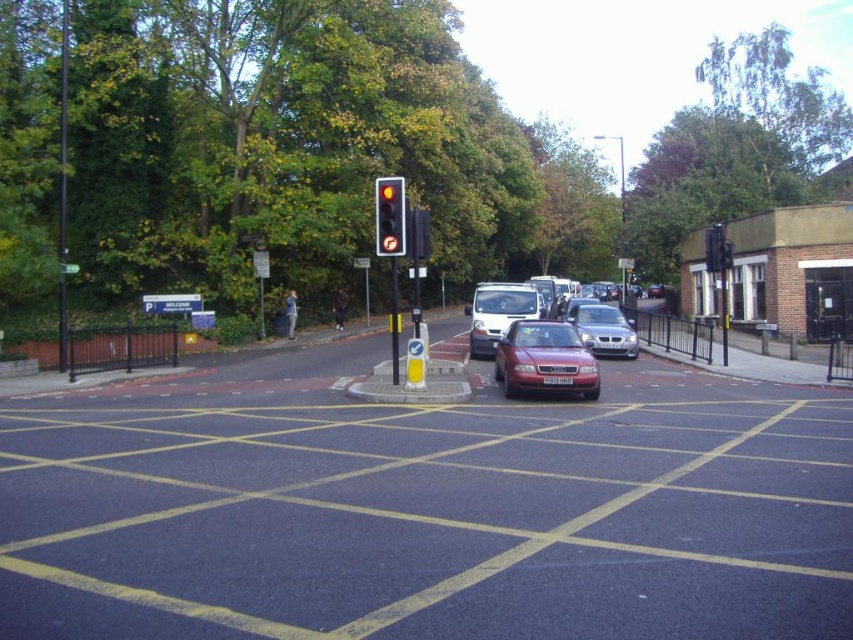
Question: From the image, what is the correct spatial relationship of shiny red car at center in relation to shiny red sedan at center?

Choices:
 (A) right
 (B) left

Answer: (A)

Question: Which point appears farthest from the camera in this image?

Choices:
 (A) (572, 340)
 (B) (634, 342)

Answer: (B)

Question: Which of the following is the farthest from the observer?

Choices:
 (A) (527, 381)
 (B) (399, 228)
 (C) (572, 310)

Answer: (C)

Question: Can you confirm if shiny red car at center is positioned to the right of shiny red sedan at center?

Choices:
 (A) yes
 (B) no

Answer: (A)

Question: Does shiny red car at center appear on the left side of shiny red sedan at center?

Choices:
 (A) yes
 (B) no

Answer: (B)

Question: Which point is closer to the camera taking this photo?

Choices:
 (A) (479, 291)
 (B) (560, 378)

Answer: (B)